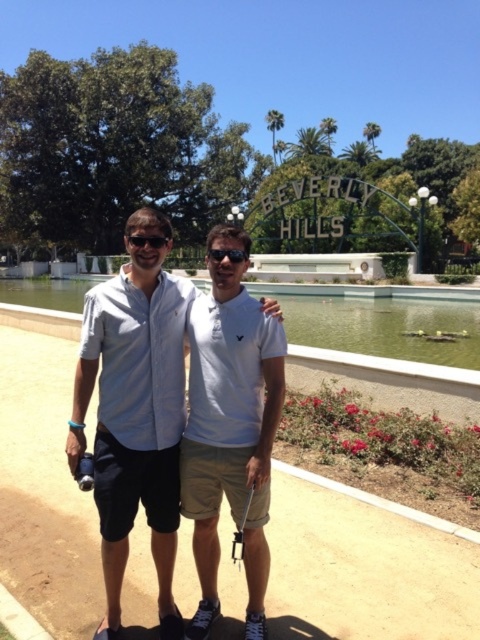
You are taking a photo of the two people in front of the Beverly Hills sign. The camera is set to focus on the point at coordinates (229, 428). Which person will be in focus?

The point at coordinates (229, 428) marks the white cotton polo shirt at center, so the person wearing the white cotton polo shirt at center will be in focus.